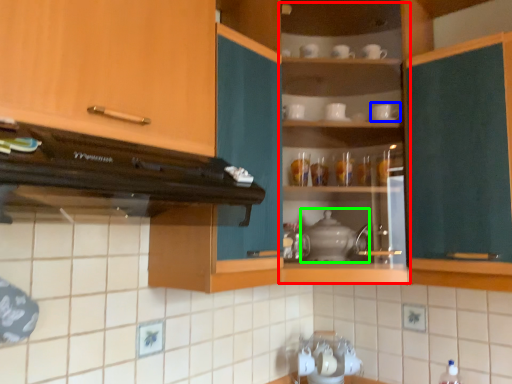
Question: Which object is the farthest from cabinet (highlighted by a red box)? Choose among these: tableware (highlighted by a blue box) or appliance (highlighted by a green box).

Choices:
 (A) tableware
 (B) appliance

Answer: (A)